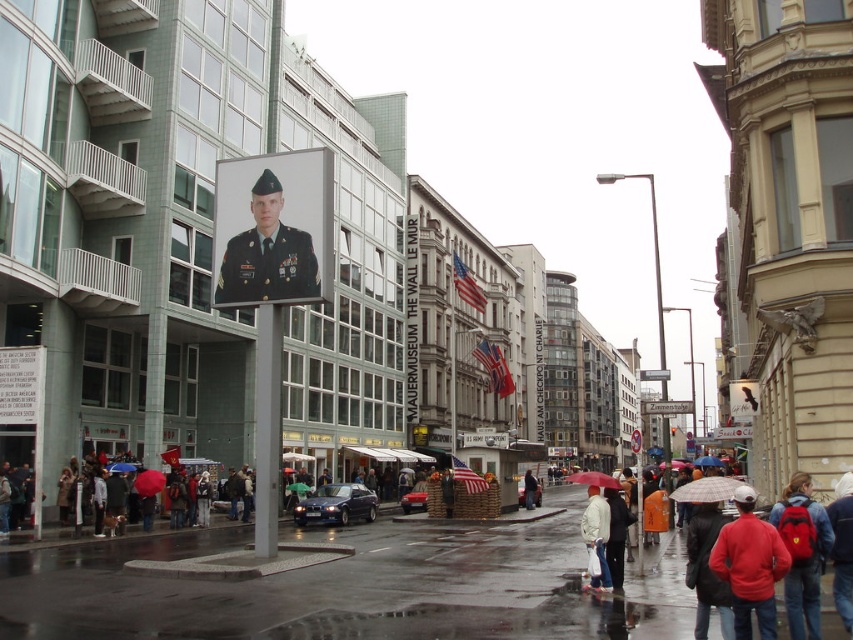
Does red matte jacket at lower right have a smaller size compared to shiny dark blue sedan at center?

Yes.

Is point (759, 536) positioned behind point (326, 497)?

No, it is in front of (326, 497).

Where is `red matte jacket at lower right`? This screenshot has width=853, height=640. red matte jacket at lower right is located at coordinates (750, 564).

Between white matte jacket at lower right and matte black uniform at center, which one appears on the left side from the viewer's perspective?

Positioned to the left is white matte jacket at lower right.

Which is behind, point (607, 515) or point (535, 499)?

The point (535, 499) is more distant.

Locate an element on the screen. The width and height of the screenshot is (853, 640). white matte jacket at lower right is located at coordinates (596, 536).

Is point (322, 486) farther from camera compared to point (534, 493)?

No, (322, 486) is closer to viewer.

Between point (314, 508) and point (524, 500), which one is positioned behind?

The point (524, 500) is behind.

You are a GUI agent. You are given a task and a screenshot of the screen. Output one action in this format:
    pyautogui.click(x=<x>, y=<y>)
    Task: Click on the shiny dark blue sedan at center
    
    Given the screenshot: What is the action you would take?
    pyautogui.click(x=335, y=504)